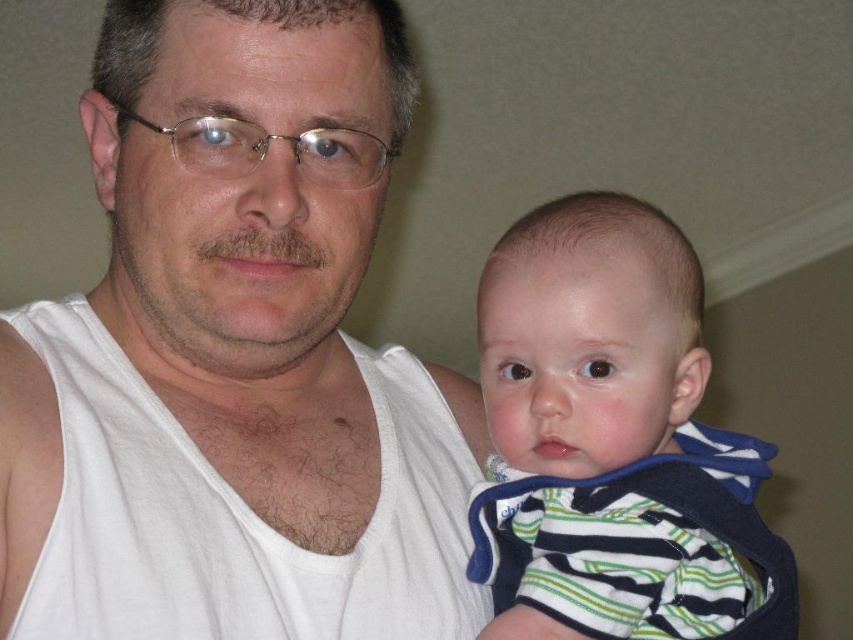
Can you confirm if white tank top at center is bigger than striped cotton onesie at center?

Yes, white tank top at center is bigger than striped cotton onesie at center.

Is white tank top at center shorter than striped cotton onesie at center?

Incorrect, white tank top at center's height does not fall short of striped cotton onesie at center's.

The image size is (853, 640). Describe the element at coordinates (234, 355) in the screenshot. I see `white tank top at center` at that location.

Locate an element on the screen. The image size is (853, 640). white tank top at center is located at coordinates (234, 355).

Does point (517, 464) come closer to viewer compared to point (630, 506)?

That is False.

Where is `striped cotton onesie at center`? Image resolution: width=853 pixels, height=640 pixels. striped cotton onesie at center is located at coordinates (613, 442).

How distant is white tank top at center from striped cotton vest at center?

white tank top at center is 6.83 inches from striped cotton vest at center.

Does white tank top at center lie behind striped cotton vest at center?

That is False.

Between point (49, 460) and point (717, 460), which one is positioned in front?

Point (49, 460) is more forward.

You are a GUI agent. You are given a task and a screenshot of the screen. Output one action in this format:
    pyautogui.click(x=<x>, y=<y>)
    Task: Click on the white tank top at center
    
    Given the screenshot: What is the action you would take?
    pyautogui.click(x=234, y=355)